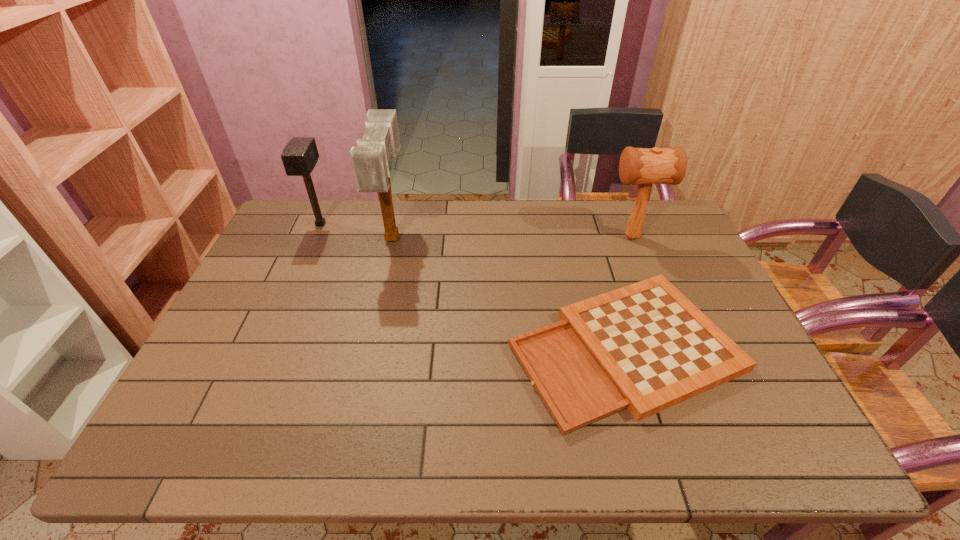
The width and height of the screenshot is (960, 540). What are the coordinates of `vacant area that lies between the leftmost mallet and the tallest mallet` in the screenshot? It's located at coord(357,231).

You are a GUI agent. You are given a task and a screenshot of the screen. Output one action in this format:
    pyautogui.click(x=<x>, y=<y>)
    Task: Click on the vacant space in between the leftmost object and the tallest mallet
    The width and height of the screenshot is (960, 540).
    Given the screenshot: What is the action you would take?
    pyautogui.click(x=357, y=231)

At what (x,y) coordinates should I click in order to perform the action: click on object identified as the closest to the leftmost object. Please return your answer as a coordinate pair (x, y). The width and height of the screenshot is (960, 540). Looking at the image, I should click on (371, 159).

At what (x,y) coordinates should I click in order to perform the action: click on the third closest object to the rightmost mallet. Please return your answer as a coordinate pair (x, y). Image resolution: width=960 pixels, height=540 pixels. Looking at the image, I should click on (300, 156).

Locate an element on the screen. mallet that stands as the closest to the nearest object is located at coordinates (646, 166).

Select which mallet appears as the second closest to the rightmost mallet. Please provide its 2D coordinates. Your answer should be formatted as a tuple, i.e. [(x, y)], where the tuple contains the x and y coordinates of a point satisfying the conditions above.

[(300, 156)]

Where is `vacant space that satisfies the following two spatial constraints: 1. on the front side of the leftmost object; 2. on the left side of the nearest object`? The height and width of the screenshot is (540, 960). vacant space that satisfies the following two spatial constraints: 1. on the front side of the leftmost object; 2. on the left side of the nearest object is located at coordinates (266, 348).